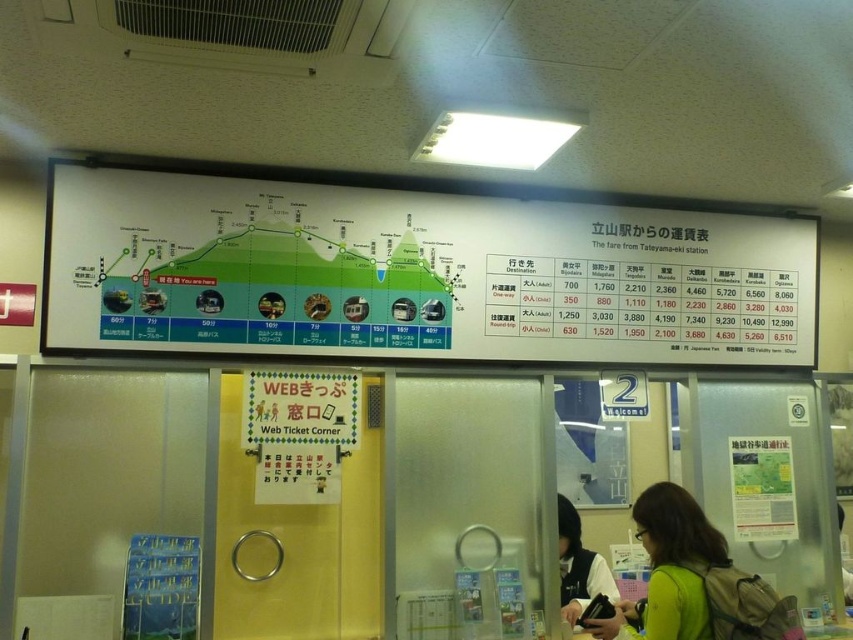
Does green fabric jacket at lower right have a greater width compared to matte black jacket at lower right?

No, green fabric jacket at lower right is not wider than matte black jacket at lower right.

Is green fabric jacket at lower right above matte black jacket at lower right?

Yes.

What do you see at coordinates (675, 561) in the screenshot? I see `green fabric jacket at lower right` at bounding box center [675, 561].

Where is `green fabric jacket at lower right`? This screenshot has width=853, height=640. green fabric jacket at lower right is located at coordinates (675, 561).

Does white paper at upper center appear over green fabric jacket at lower right?

Yes, white paper at upper center is above green fabric jacket at lower right.

What do you see at coordinates (416, 273) in the screenshot? This screenshot has width=853, height=640. I see `white paper at upper center` at bounding box center [416, 273].

Find the location of a particular element. white paper at upper center is located at coordinates (416, 273).

Can you confirm if white paper at upper center is wider than matte black jacket at lower right?

Correct, the width of white paper at upper center exceeds that of matte black jacket at lower right.

Is white paper at upper center further to the viewer compared to matte black jacket at lower right?

No, white paper at upper center is in front of matte black jacket at lower right.

The width and height of the screenshot is (853, 640). I want to click on white paper at upper center, so click(x=416, y=273).

Locate an element on the screen. white paper at upper center is located at coordinates (416, 273).